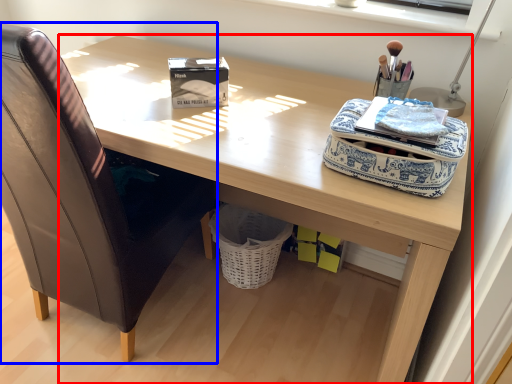
Question: Among these objects, which one is nearest to the camera, desk (highlighted by a red box) or chair (highlighted by a blue box)?

Choices:
 (A) desk
 (B) chair

Answer: (B)